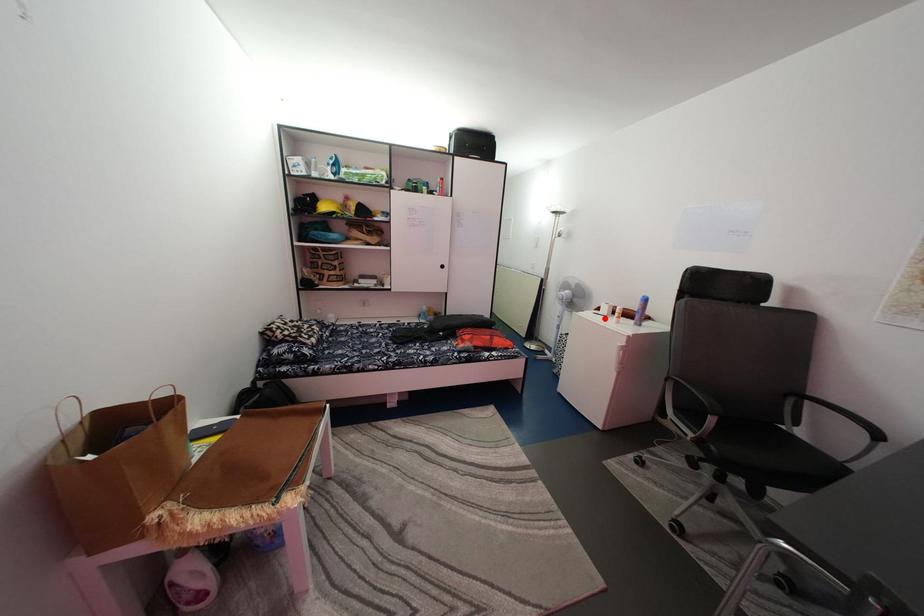
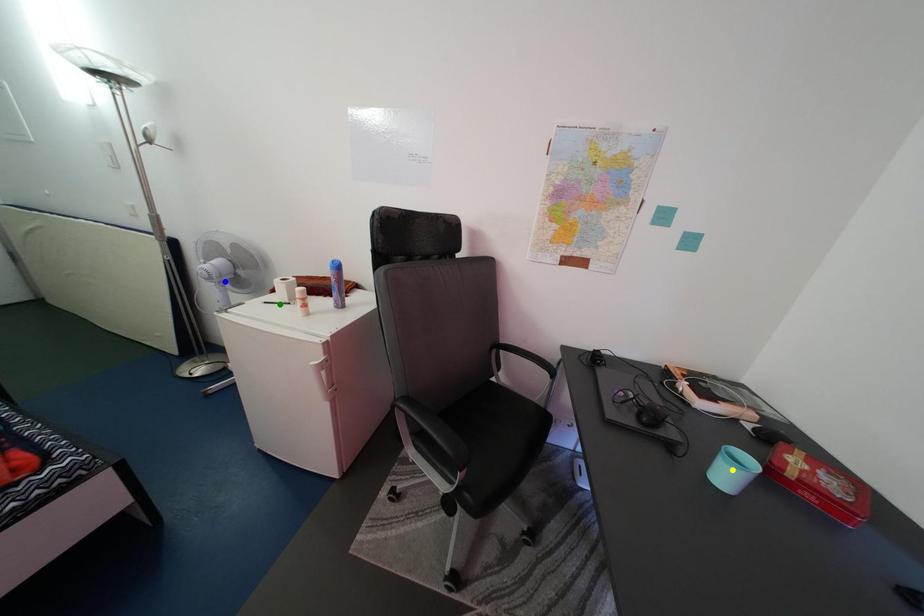
Question: I am providing you with two images of the same scene from different viewpoints. A red point is marked on the first image. You are given multiple points on the second image. Which mark in image 2 goes with the point in image 1?

Choices:
 (A) green point
 (B) blue point
 (C) yellow point

Answer: (A)